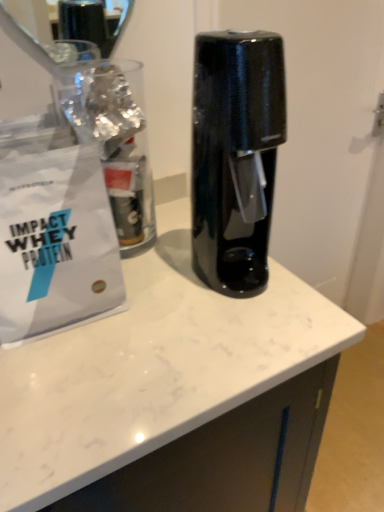
The width and height of the screenshot is (384, 512). Describe the element at coordinates (55, 244) in the screenshot. I see `white matte paper bag at left` at that location.

This screenshot has height=512, width=384. In order to click on white matte paper bag at left in this screenshot , I will do `click(55, 244)`.

Measure the distance between white matte paper bag at left and camera.

They are 24.32 inches apart.

This screenshot has height=512, width=384. What are the coordinates of `white matte paper bag at left` in the screenshot? It's located at (55, 244).